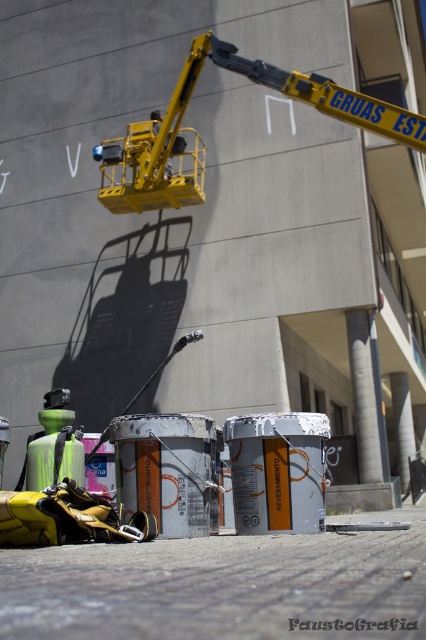
At what (x,y) coordinates should I click in order to perform the action: click on yellow metallic crane at upper center. Please return your answer as a coordinate pair (x, y). Looking at the image, I should click on (204, 145).

Can you confirm if yellow metallic crane at upper center is wider than yellow metallic crane arm at upper center?

Indeed, yellow metallic crane at upper center has a greater width compared to yellow metallic crane arm at upper center.

Is point (132, 189) positioned in front of point (169, 173)?

Yes, it is in front of point (169, 173).

You are a GUI agent. You are given a task and a screenshot of the screen. Output one action in this format:
    pyautogui.click(x=<x>, y=<y>)
    Task: Click on the yellow metallic crane at upper center
    The image size is (426, 640).
    Given the screenshot: What is the action you would take?
    pyautogui.click(x=204, y=145)